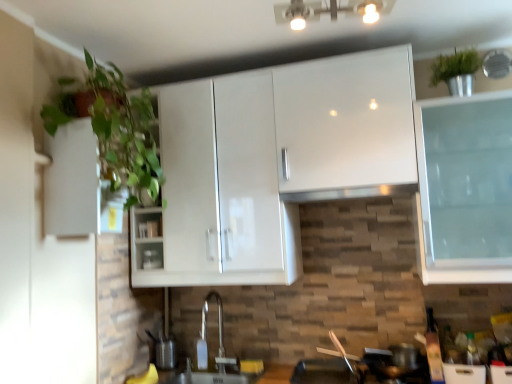
Where is `white glossy cabinet at left`? Image resolution: width=512 pixels, height=384 pixels. white glossy cabinet at left is located at coordinates (78, 185).

Describe the element at coordinates (78, 185) in the screenshot. I see `white glossy cabinet at left` at that location.

What do you see at coordinates (206, 377) in the screenshot? The width and height of the screenshot is (512, 384). I see `matte silver sink at lower center, arranged as the 2th sink when viewed from the top` at bounding box center [206, 377].

You are a GUI agent. You are given a task and a screenshot of the screen. Output one action in this format:
    pyautogui.click(x=<x>, y=<y>)
    Task: Click on the satin nickel faucet at center, which is the first sink in top-to-bottom order
    Image resolution: width=512 pixels, height=384 pixels.
    Given the screenshot: What is the action you would take?
    pyautogui.click(x=207, y=355)

Image resolution: width=512 pixels, height=384 pixels. What do you see at coordinates (123, 130) in the screenshot?
I see `green leafy plant at left` at bounding box center [123, 130].

Find the location of a particular element. metallic silver toaster at center is located at coordinates (152, 259).

What do you see at coordinates (329, 11) in the screenshot?
I see `white glossy light fixture at upper center` at bounding box center [329, 11].

What is the approximate height of white glossy light fixture at upper center?

white glossy light fixture at upper center is 6.43 inches tall.

The height and width of the screenshot is (384, 512). I want to click on satin silver exhaust hood at center, so click(350, 193).

Is satin nickel faucet at center, which is the first sink in top-to-bottom order, to the right of metallic silver toaster at center from the viewer's perspective?

Yes, satin nickel faucet at center, which is the first sink in top-to-bottom order, is to the right of metallic silver toaster at center.

In the scene shown: Is satin nickel faucet at center, arranged as the 2th sink when ordered from the bottom, turned away from metallic silver toaster at center?

No, satin nickel faucet at center, arranged as the 2th sink when ordered from the bottom, is not facing the opposite direction of metallic silver toaster at center.

Does satin silver exhaust hood at center contain white glossy cabinet at left?

Definitely not — white glossy cabinet at left is not inside satin silver exhaust hood at center.

From the picture: From a real-world perspective, is satin silver exhaust hood at center below white glossy cabinet at left?

Correct, in the physical world, satin silver exhaust hood at center is lower than white glossy cabinet at left.

Which object is closer to the camera taking this photo, satin silver exhaust hood at center or white glossy cabinet at left?

white glossy cabinet at left is more forward.

From the image's perspective, is green leafy plant at left positioned above or below matte silver sink at lower center, arranged as the 2th sink when viewed from the top?

From the image's perspective, green leafy plant at left appears above matte silver sink at lower center, arranged as the 2th sink when viewed from the top.

Is point (129, 107) positioned behind point (203, 382)?

That is False.

Where is `houseplant located above the matte silver sink at lower center, which ranks as the first sink in bottom-to-top order (from the image's perspective)`? The height and width of the screenshot is (384, 512). houseplant located above the matte silver sink at lower center, which ranks as the first sink in bottom-to-top order (from the image's perspective) is located at coordinates (123, 130).

Which object is more forward, green leafy plant at left or matte silver sink at lower center, arranged as the 2th sink when viewed from the top?

Positioned in front is green leafy plant at left.

Can you tell me how much metallic silver toaster at center and satin silver exhaust hood at center differ in facing direction?

They differ by 6.75 degrees in their facing directions.

From the image's perspective, which is above, metallic silver toaster at center or satin silver exhaust hood at center?

satin silver exhaust hood at center is shown above in the image.

Which object is positioned more to the left, metallic silver toaster at center or satin silver exhaust hood at center?

metallic silver toaster at center.

Can you confirm if white glossy cabinet at left is positioned to the left of metallic silver toaster at center?

Correct, you'll find white glossy cabinet at left to the left of metallic silver toaster at center.

Is point (72, 175) closer or farther from the camera than point (150, 259)?

Point (72, 175) appears to be closer to the viewer than point (150, 259).

Can you confirm if white glossy cabinet at left is taller than metallic silver toaster at center?

Indeed, white glossy cabinet at left has a greater height compared to metallic silver toaster at center.

How much distance is there between white glossy cabinet at left and metallic silver toaster at center?

25.85 inches.

Locate an element on the screen. The image size is (512, 384). cabinetry above the satin nickel faucet at center, which is the first sink in top-to-bottom order (from the image's perspective) is located at coordinates (78, 185).

Can you confirm if satin nickel faucet at center, which is the first sink in top-to-bottom order, is taller than white glossy cabinet at left?

In fact, satin nickel faucet at center, which is the first sink in top-to-bottom order, may be shorter than white glossy cabinet at left.

Is satin nickel faucet at center, which is the first sink in top-to-bottom order, in front of white glossy cabinet at left?

No, it is not.

How much distance is there between white glossy cabinet at left and satin nickel faucet at center, arranged as the 2th sink when ordered from the bottom?

The distance of white glossy cabinet at left from satin nickel faucet at center, arranged as the 2th sink when ordered from the bottom, is 1.04 meters.

Is white glossy cabinet at left not within satin nickel faucet at center, arranged as the 2th sink when ordered from the bottom?

Yes, white glossy cabinet at left is not within satin nickel faucet at center, arranged as the 2th sink when ordered from the bottom.

Can you confirm if white glossy cabinet at left is positioned to the left of satin nickel faucet at center, which is the first sink in top-to-bottom order?

Yes.

Considering the points (118, 213) and (221, 336), which point is in front, point (118, 213) or point (221, 336)?

The point (118, 213) is in front.

Find the location of a particular element. the 2nd sink counting from the right of the metallic silver toaster at center is located at coordinates (207, 355).

Locate an element on the screen. The height and width of the screenshot is (384, 512). cabinetry that appears on the left of satin silver exhaust hood at center is located at coordinates (78, 185).

Which object lies nearer to the anchor point satin nickel faucet at center, which is the first sink in top-to-bottom order, metallic silver toaster at center or satin silver exhaust hood at center?

The object closer to satin nickel faucet at center, which is the first sink in top-to-bottom order, is metallic silver toaster at center.

Considering their positions, is satin silver exhaust hood at center positioned closer to metallic silver toaster at center than white glossy light fixture at upper center?

Among the two, satin silver exhaust hood at center is located nearer to metallic silver toaster at center.

Which object lies nearer to the anchor point satin silver exhaust hood at center, green leafy plant at left or white glossy cabinet at left?

The object closer to satin silver exhaust hood at center is green leafy plant at left.

From the picture: Considering their positions, is satin silver exhaust hood at center positioned further to white glossy cabinet at left than white glossy light fixture at upper center?

white glossy light fixture at upper center.

From the image, which object appears to be farther from matte silver sink at lower center, which ranks as the first sink in bottom-to-top order, white glossy light fixture at upper center or white glossy cabinet at left?

The object further to matte silver sink at lower center, which ranks as the first sink in bottom-to-top order, is white glossy light fixture at upper center.

Considering their positions, is satin nickel faucet at center, arranged as the 2th sink when ordered from the bottom, positioned further to metallic silver toaster at center than white glossy cabinet at left?

white glossy cabinet at left.

Based on their spatial positions, is matte silver sink at lower center, which ranks as the first sink in bottom-to-top order, or green leafy plant at left closer to white glossy light fixture at upper center?

Based on the image, green leafy plant at left appears to be nearer to white glossy light fixture at upper center.

Consider the image. Estimate the real-world distances between objects in this image. Which object is closer to white glossy light fixture at upper center, satin nickel faucet at center, arranged as the 2th sink when ordered from the bottom, or metallic silver toaster at center?

The object closer to white glossy light fixture at upper center is metallic silver toaster at center.

Locate an element on the screen. Image resolution: width=512 pixels, height=384 pixels. light fixture situated between green leafy plant at left and satin silver exhaust hood at center from left to right is located at coordinates tap(329, 11).

Where is `cabinetry located between green leafy plant at left and metallic silver toaster at center in the depth direction`? cabinetry located between green leafy plant at left and metallic silver toaster at center in the depth direction is located at coordinates (78, 185).

Identify the location of appliance that lies between white glossy light fixture at upper center and satin nickel faucet at center, arranged as the 2th sink when ordered from the bottom, from top to bottom. The image size is (512, 384). (x=152, y=259).

At what (x,y) coordinates should I click in order to perform the action: click on appliance located between white glossy cabinet at left and white glossy light fixture at upper center in the left-right direction. Please return your answer as a coordinate pair (x, y). Looking at the image, I should click on (x=152, y=259).